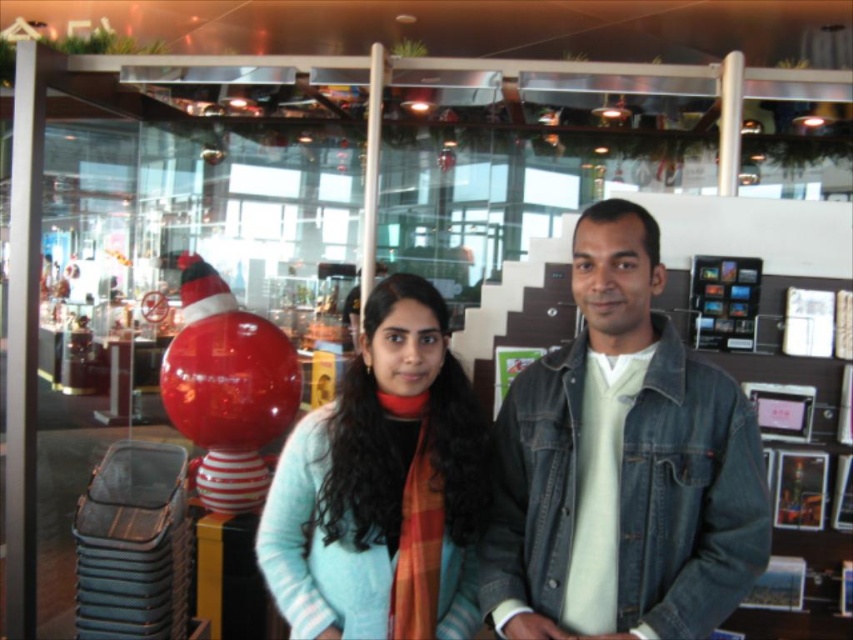
You are trying to locate two people in the image. The first person is wearing a light blue sweater at center, and the second is wearing a denim jacket at center. Based on their positions, which clothing item is closer to the right side of the image?

The denim jacket at center is positioned to the right of the light blue sweater at center, so the denim jacket at center is closer to the right side of the image.